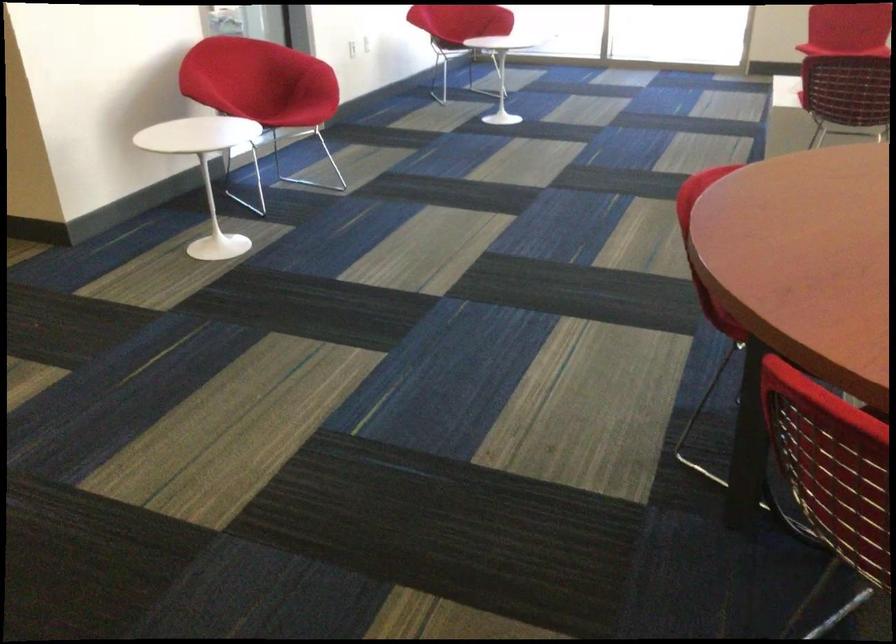
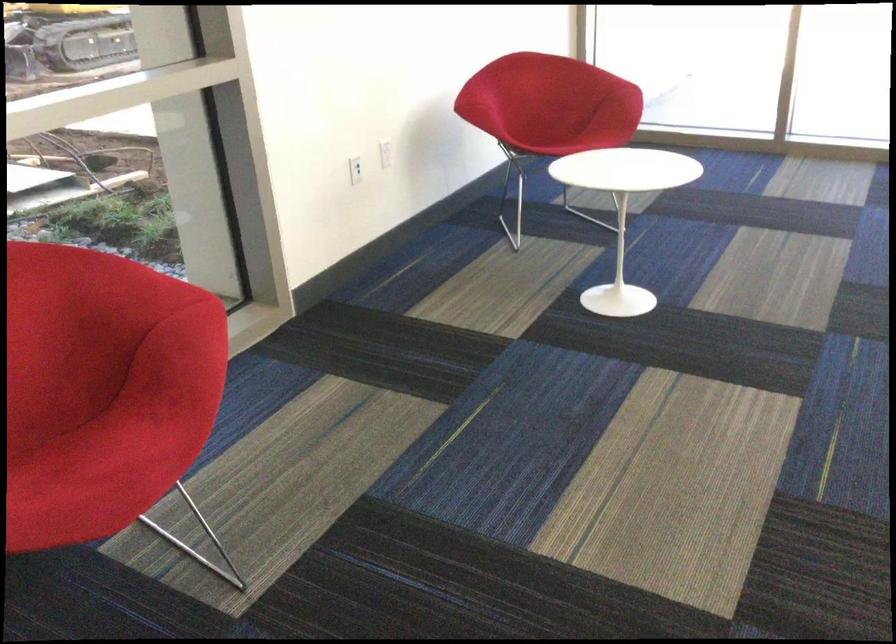
Question: The images are taken continuously from a first-person perspective. In which direction are you moving?

Choices:
 (A) Left
 (B) Right
 (C) Forward
 (D) Backward

Answer: (C)